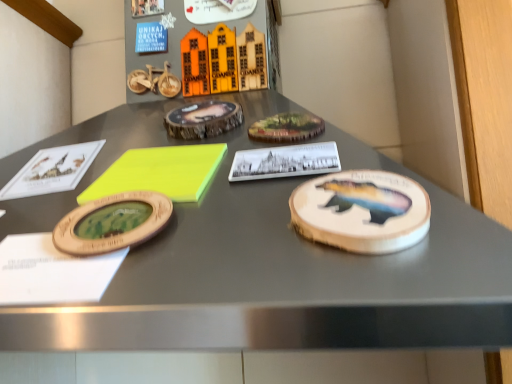
Question: Does wooden coaster with bear design at right have a larger size compared to neon yellow foam at center?

Choices:
 (A) no
 (B) yes

Answer: (A)

Question: Does wooden coaster with bear design at right turn towards neon yellow foam at center?

Choices:
 (A) yes
 (B) no

Answer: (B)

Question: Can neon yellow foam at center be found inside wooden coaster with bear design at right?

Choices:
 (A) no
 (B) yes

Answer: (A)

Question: Is the position of wooden coaster with bear design at right more distant than that of neon yellow foam at center?

Choices:
 (A) no
 (B) yes

Answer: (A)

Question: Are wooden coaster with bear design at right and neon yellow foam at center beside each other?

Choices:
 (A) yes
 (B) no

Answer: (B)

Question: From a real-world perspective, is wooden coaster with bear design at right on top of neon yellow foam at center?

Choices:
 (A) yes
 (B) no

Answer: (B)

Question: Is neon yellow foam at center behind wooden coaster with bear design at right?

Choices:
 (A) no
 (B) yes

Answer: (B)

Question: Can you confirm if neon yellow foam at center is shorter than wooden coaster with bear design at right?

Choices:
 (A) yes
 (B) no

Answer: (B)

Question: Can you confirm if neon yellow foam at center is smaller than wooden coaster with bear design at right?

Choices:
 (A) yes
 (B) no

Answer: (B)

Question: Would you say wooden coaster with bear design at right is part of neon yellow foam at center's contents?

Choices:
 (A) no
 (B) yes

Answer: (A)

Question: Is the position of neon yellow foam at center less distant than that of wooden coaster with bear design at right?

Choices:
 (A) yes
 (B) no

Answer: (B)

Question: Is neon yellow foam at center to the right of wooden coaster with bear design at right from the viewer's perspective?

Choices:
 (A) yes
 (B) no

Answer: (B)

Question: From the image's perspective, is wooden coaster with bear design at right located above or below neon yellow foam at center?

Choices:
 (A) below
 (B) above

Answer: (A)